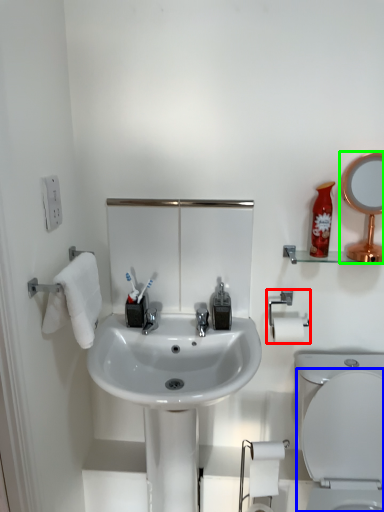
Question: Considering the real-world distances, which object is closest to towel bar (highlighted by a red box)? toilet (highlighted by a blue box) or mirror (highlighted by a green box).

Choices:
 (A) toilet
 (B) mirror

Answer: (B)